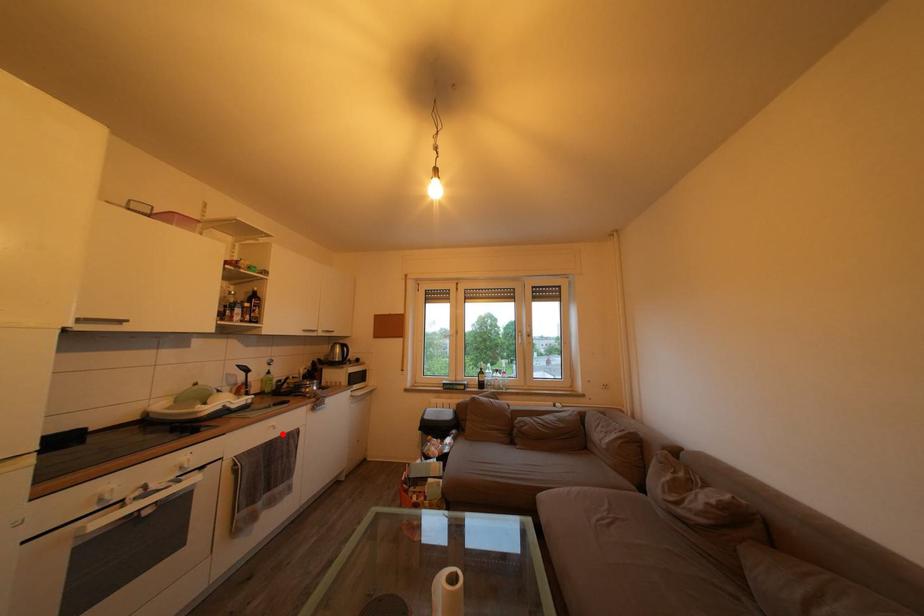
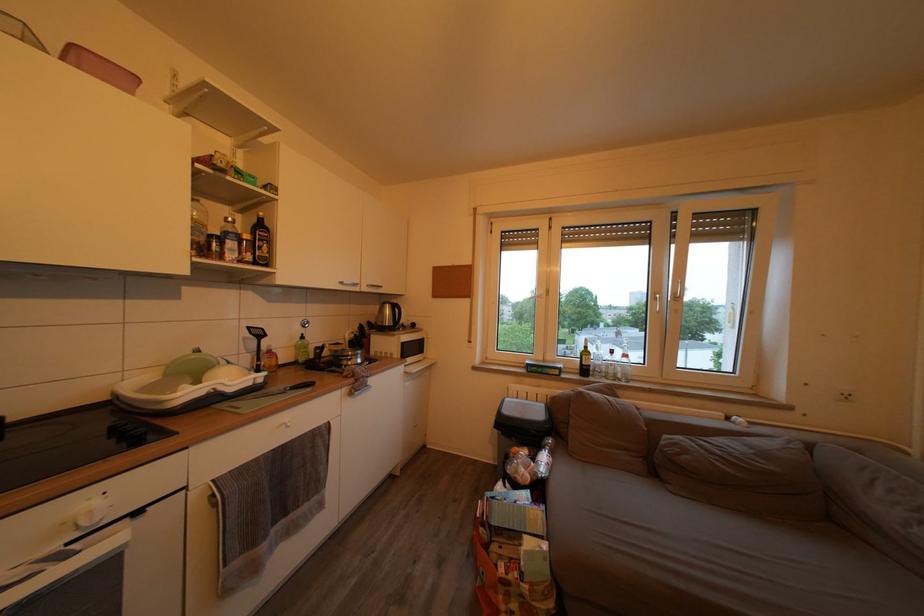
Where in the second image is the point corresponding to the highlighted location from the first image?

(296, 432)